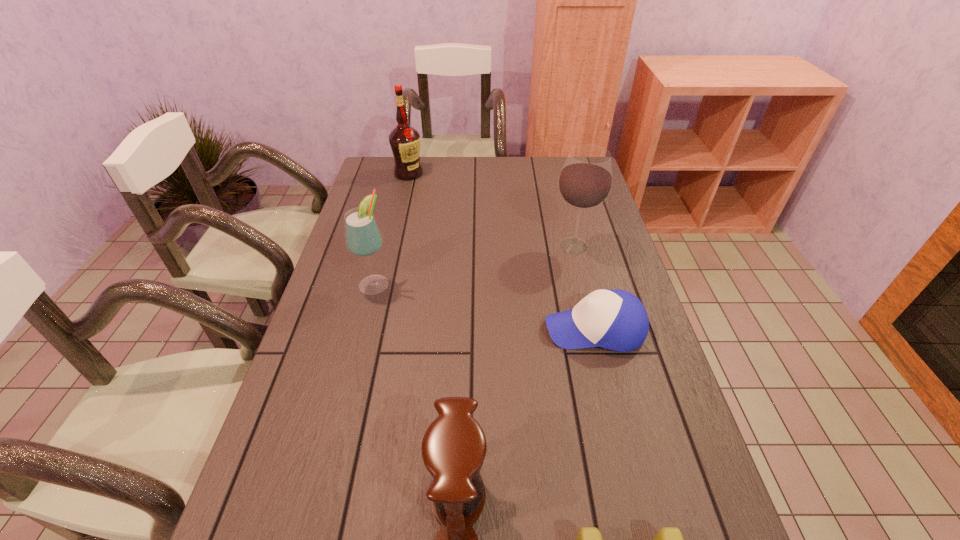
At what (x,y) coordinates should I click in order to perform the action: click on vacant point located on the front-facing side of the third nearest object. Please return your answer as a coordinate pair (x, y). The image size is (960, 540). Looking at the image, I should click on (521, 329).

You are a GUI agent. You are given a task and a screenshot of the screen. Output one action in this format:
    pyautogui.click(x=<x>, y=<y>)
    Task: Click on the vacant space situated 0.120m on the front-facing side of the third nearest object
    This screenshot has height=540, width=960.
    Given the screenshot: What is the action you would take?
    pyautogui.click(x=498, y=329)

Find the location of a particular element. object at the far edge is located at coordinates (404, 140).

Identify the location of alcohol that is at the right edge. The width and height of the screenshot is (960, 540). (585, 181).

What are the coordinates of `baseball cap at the right edge` in the screenshot? It's located at (616, 320).

This screenshot has width=960, height=540. What are the coordinates of `object present at the far left corner` in the screenshot? It's located at (404, 140).

The image size is (960, 540). I want to click on vacant space at the far edge of the desktop, so click(x=552, y=182).

Where is `vacant space at the left edge of the desktop`? The height and width of the screenshot is (540, 960). vacant space at the left edge of the desktop is located at coordinates (278, 446).

Find the location of a particular element. free location at the right edge of the desktop is located at coordinates (630, 467).

At what (x,y) coordinates should I click in order to perform the action: click on vacant space at the far right corner of the desktop. Please return your answer as a coordinate pair (x, y). Looking at the image, I should click on (553, 178).